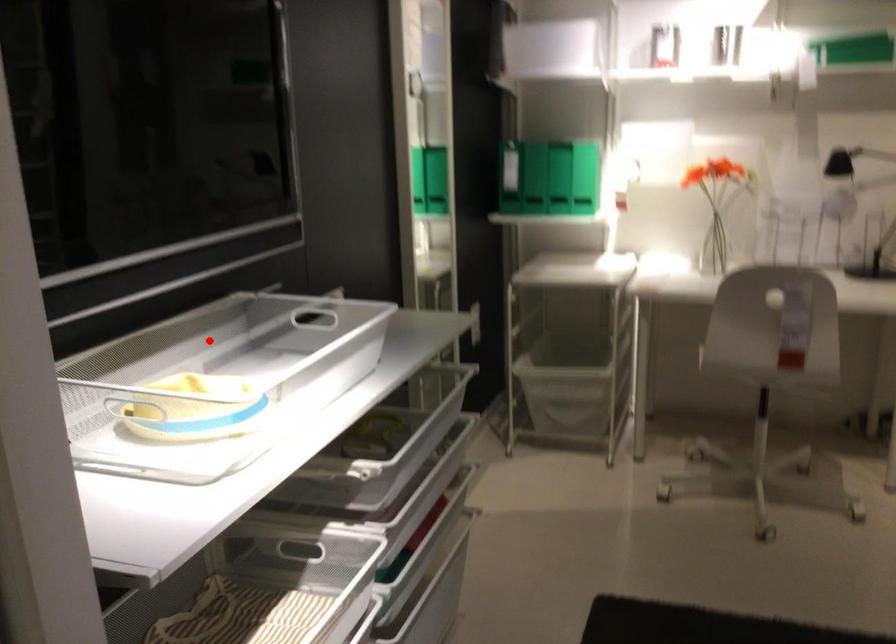
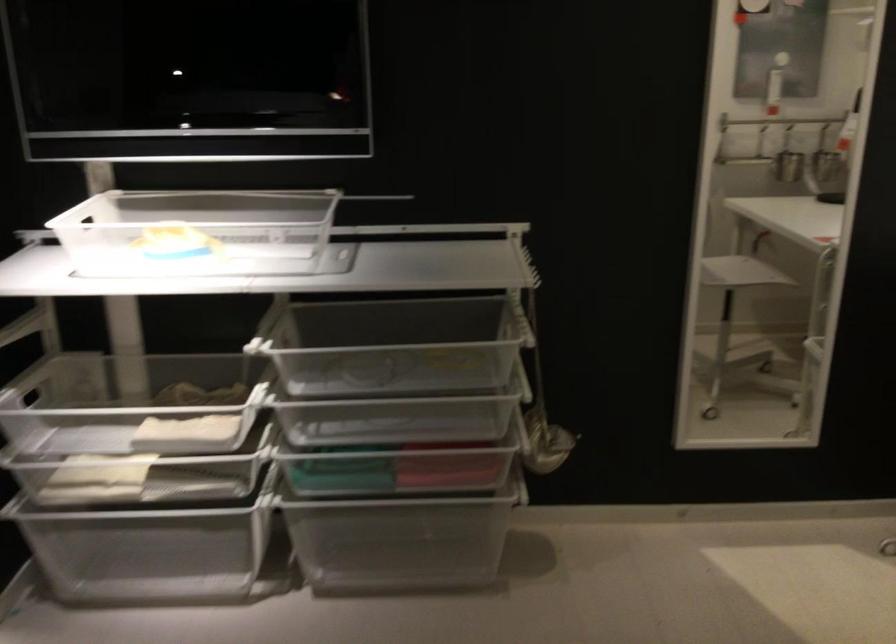
In the second image, find the point that corresponds to the highlighted location in the first image.

(197, 232)